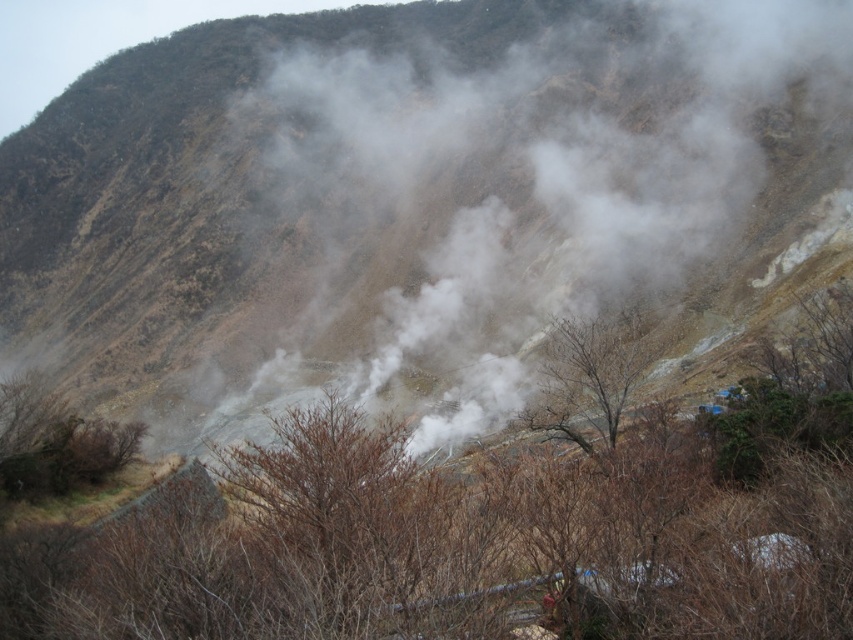
Is brown leafless tree at center below brown leafless tree at lower left?

No, brown leafless tree at center is not below brown leafless tree at lower left.

Does brown leafless tree at center come behind brown leafless tree at lower left?

No.

Is point (827, 636) behind point (39, 452)?

No, (827, 636) is closer to viewer.

The image size is (853, 640). I want to click on brown leafless tree at center, so click(x=480, y=529).

Which of these two, brown rocky mountain at center or brown leafless tree at lower left, stands shorter?

Standing shorter between the two is brown leafless tree at lower left.

Who is more distant from viewer, (x=752, y=115) or (x=55, y=422)?

The point (x=752, y=115) is more distant.

Who is more forward, [28,291] or [44,429]?

Positioned in front is point [44,429].

The height and width of the screenshot is (640, 853). I want to click on brown rocky mountain at center, so click(413, 192).

Which is above, brown rocky mountain at center or brown leafless tree at center?

Positioned higher is brown rocky mountain at center.

Image resolution: width=853 pixels, height=640 pixels. What are the coordinates of `brown rocky mountain at center` in the screenshot? It's located at (413, 192).

Between point (427, 193) and point (776, 497), which one is positioned behind?

Point (427, 193)

This screenshot has width=853, height=640. I want to click on brown rocky mountain at center, so click(413, 192).